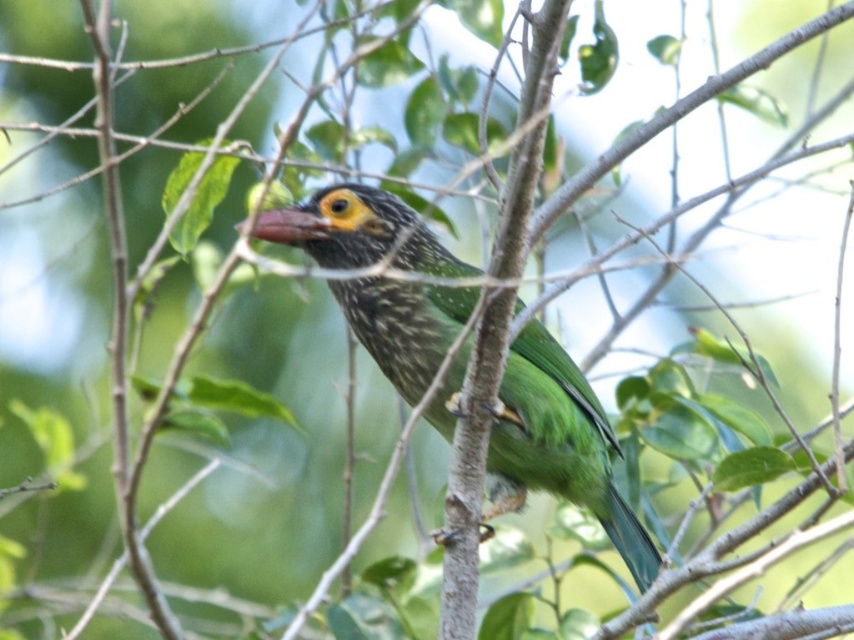
Is green glossy bird at center wider than smooth red beak at center?

Indeed, green glossy bird at center has a greater width compared to smooth red beak at center.

Does green glossy bird at center lie behind smooth red beak at center?

Yes.

Between point (393, 282) and point (256, 234), which one is positioned behind?

Positioned behind is point (393, 282).

This screenshot has width=854, height=640. In order to click on green glossy bird at center in this screenshot , I will do `click(559, 445)`.